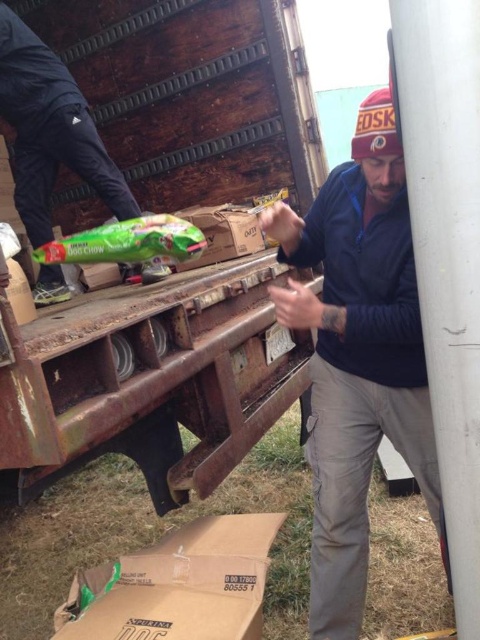
Between rusty metal trailer truck at upper left and blue fleece jacket at center, which one is positioned lower?

blue fleece jacket at center is lower down.

Is rusty metal trailer truck at upper left below blue fleece jacket at center?

Actually, rusty metal trailer truck at upper left is above blue fleece jacket at center.

The height and width of the screenshot is (640, 480). In order to click on rusty metal trailer truck at upper left in this screenshot , I will do `click(151, 378)`.

What are the coordinates of `rusty metal trailer truck at upper left` in the screenshot? It's located at (151, 378).

Does rusty metal trailer truck at upper left have a greater height compared to brown cardboard box at lower center?

Yes.

Does rusty metal trailer truck at upper left have a larger size compared to brown cardboard box at lower center?

Yes.

Does point (247, 44) come farther from viewer compared to point (175, 600)?

Yes.

Identify the location of rusty metal trailer truck at upper left. Image resolution: width=480 pixels, height=640 pixels. (151, 378).

Does green matte dog chow bag at left have a lesser height compared to brown cardboard box at center?

No.

Does green matte dog chow bag at left have a lesser width compared to brown cardboard box at center?

Incorrect, green matte dog chow bag at left's width is not less than brown cardboard box at center's.

Describe the element at coordinates (49, 131) in the screenshot. I see `green matte dog chow bag at left` at that location.

Locate an element on the screen. Image resolution: width=480 pixels, height=640 pixels. green matte dog chow bag at left is located at coordinates (49, 131).